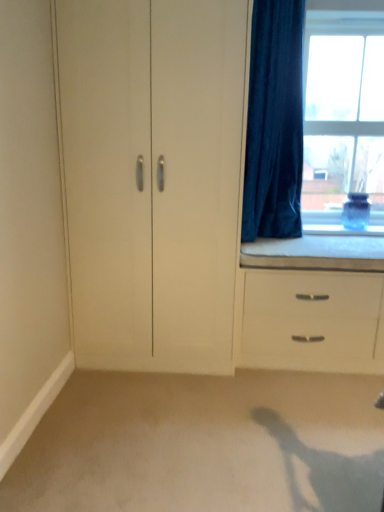
Question: Is white matte cabinet at center completely or partially inside white matte chest of drawers at lower right?

Choices:
 (A) yes
 (B) no

Answer: (B)

Question: From the image's perspective, is white matte chest of drawers at lower right located beneath white matte cabinet at center?

Choices:
 (A) no
 (B) yes

Answer: (B)

Question: From a real-world perspective, is white matte chest of drawers at lower right physically above white matte cabinet at center?

Choices:
 (A) yes
 (B) no

Answer: (B)

Question: Can we say white matte chest of drawers at lower right lies outside white matte cabinet at center?

Choices:
 (A) yes
 (B) no

Answer: (A)

Question: Is white matte chest of drawers at lower right not near white matte cabinet at center?

Choices:
 (A) no
 (B) yes

Answer: (A)

Question: From a real-world perspective, relative to beige carpet at lower center, is clear glass window at upper right vertically above or below?

Choices:
 (A) below
 (B) above

Answer: (B)

Question: Is point (352, 109) positioned closer to the camera than point (299, 478)?

Choices:
 (A) farther
 (B) closer

Answer: (A)

Question: Considering the relative positions of clear glass window at upper right and beige carpet at lower center in the image provided, is clear glass window at upper right to the left or to the right of beige carpet at lower center?

Choices:
 (A) left
 (B) right

Answer: (B)

Question: From their relative heights in the image, would you say clear glass window at upper right is taller or shorter than beige carpet at lower center?

Choices:
 (A) short
 (B) tall

Answer: (B)

Question: Does point (273, 287) appear closer or farther from the camera than point (306, 25)?

Choices:
 (A) farther
 (B) closer

Answer: (B)

Question: In terms of width, does white matte chest of drawers at lower right look wider or thinner when compared to clear glass window at upper right?

Choices:
 (A) wide
 (B) thin

Answer: (A)

Question: Based on their positions, is white matte chest of drawers at lower right located to the left or right of clear glass window at upper right?

Choices:
 (A) right
 (B) left

Answer: (B)

Question: Would you say white matte chest of drawers at lower right is inside or outside clear glass window at upper right?

Choices:
 (A) outside
 (B) inside

Answer: (A)

Question: Choose the correct answer: Is beige carpet at lower center inside velvet dark blue curtain at right or outside it?

Choices:
 (A) inside
 (B) outside

Answer: (B)

Question: From a real-world perspective, is beige carpet at lower center positioned above or below velvet dark blue curtain at right?

Choices:
 (A) below
 (B) above

Answer: (A)